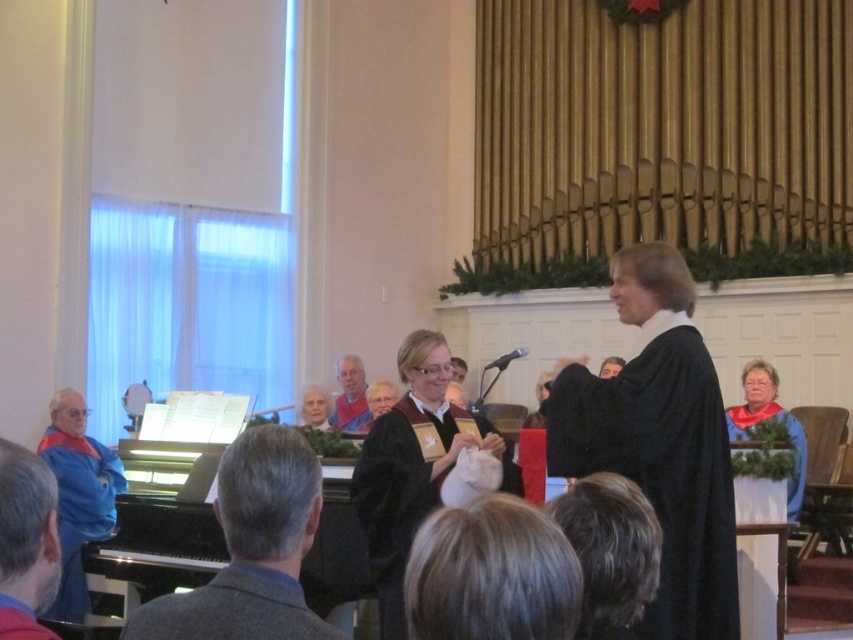
Question: Considering the relative positions of blue fabric at lower left and matte red robe at center in the image provided, where is blue fabric at lower left located with respect to matte red robe at center?

Choices:
 (A) above
 (B) below

Answer: (A)

Question: Is blue fabric at lower left above blue fleece robe at left?

Choices:
 (A) no
 (B) yes

Answer: (B)

Question: Does gray woolen robe at center appear over blue fleece robe at left?

Choices:
 (A) no
 (B) yes

Answer: (B)

Question: Among these objects, which one is nearest to the camera?

Choices:
 (A) gray woolen robe at center
 (B) black matte robe at right

Answer: (A)

Question: Which point appears farthest from the camera in this image?

Choices:
 (A) (769, 410)
 (B) (35, 483)
 (C) (16, 611)

Answer: (A)

Question: Which point is closer to the camera?

Choices:
 (A) (792, 515)
 (B) (264, 580)
 (C) (445, 449)
 (D) (354, 374)

Answer: (B)